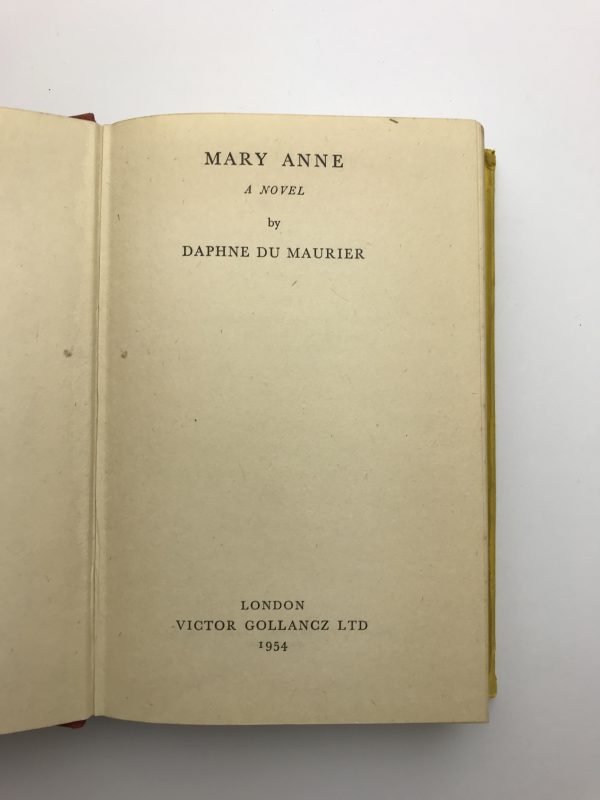
At what (x,y) coordinates should I click in order to perform the action: click on teeny tiny piece of front cover of book. Please return your answer as a coordinate pair (x, y). This screenshot has height=800, width=600. Looking at the image, I should click on (88, 116).